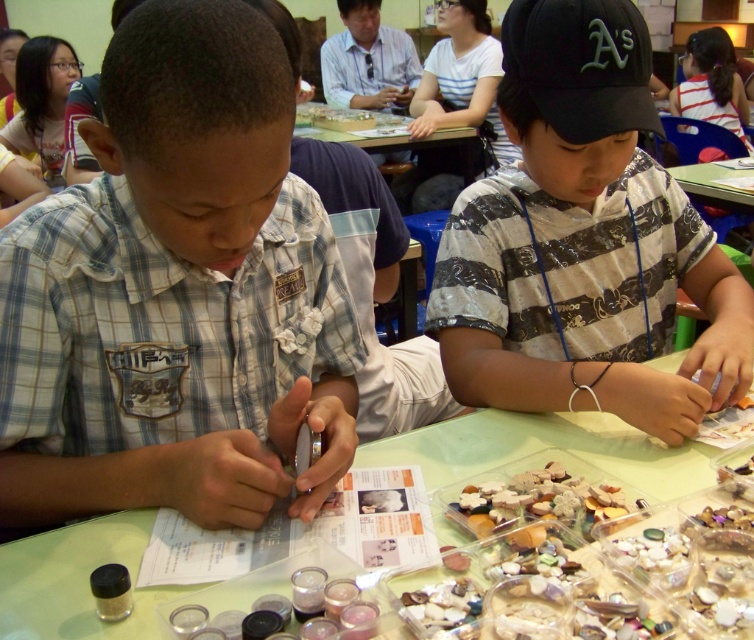
Question: Which of the following is the farthest from the observer?

Choices:
 (A) black striped shirt at center
 (B) clear plastic table at center
 (C) plaid shirt at left

Answer: (A)

Question: Which point is closer to the camera?

Choices:
 (A) black striped shirt at center
 (B) clear plastic table at center
 (C) plaid shirt at left

Answer: (C)

Question: Estimate the real-world distances between objects in this image. Which object is farther from the clear plastic table at center?

Choices:
 (A) black striped shirt at center
 (B) plaid shirt at left

Answer: (B)

Question: Does plaid shirt at left appear over clear plastic table at center?

Choices:
 (A) yes
 (B) no

Answer: (A)

Question: Can you confirm if plaid shirt at left is positioned to the right of black striped shirt at center?

Choices:
 (A) no
 (B) yes

Answer: (A)

Question: Can you confirm if black striped shirt at center is positioned below clear plastic table at center?

Choices:
 (A) no
 (B) yes

Answer: (A)